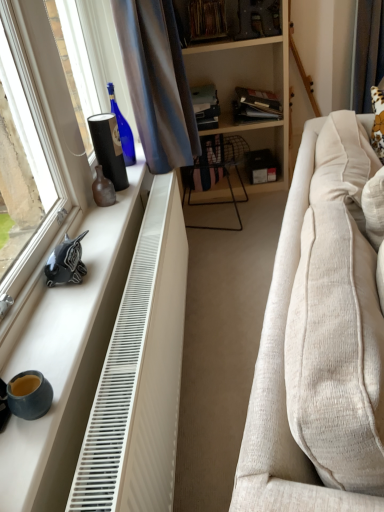
Image resolution: width=384 pixels, height=512 pixels. In order to click on vacant region above white matte window sill at left (from a real-world perspective) in this screenshot , I will do `click(71, 296)`.